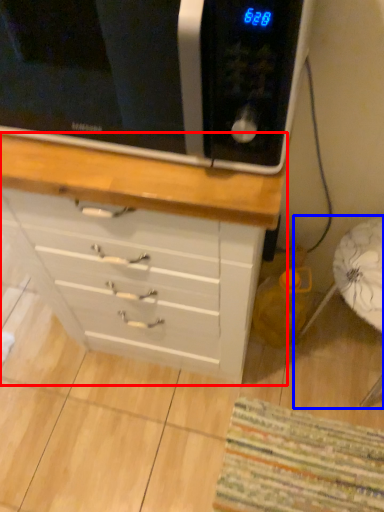
Question: Which point is further to the camera, chest of drawers (highlighted by a red box) or swivel chair (highlighted by a blue box)?

Choices:
 (A) chest of drawers
 (B) swivel chair

Answer: (B)